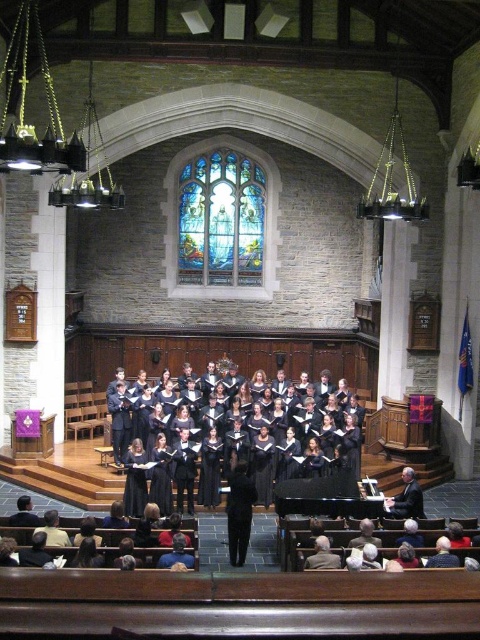
You are standing at the point labeled point (337, 486) in the church. The choir is 65.28 feet away from you. If you want to move closer to the choir, which direction should you move?

To move closer to the choir, you should move in the direction towards the choir, which is 65.28 feet away from the point labeled point (337, 486).